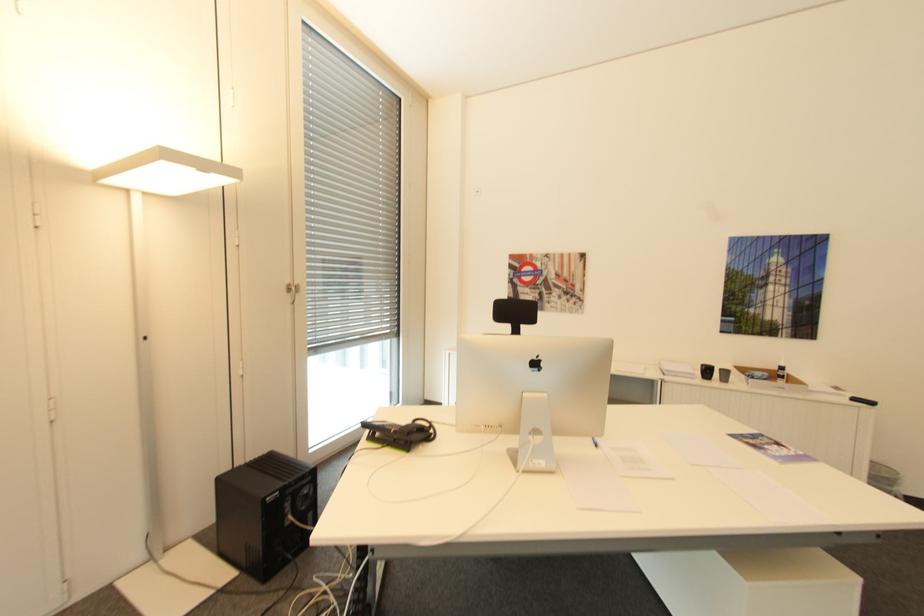
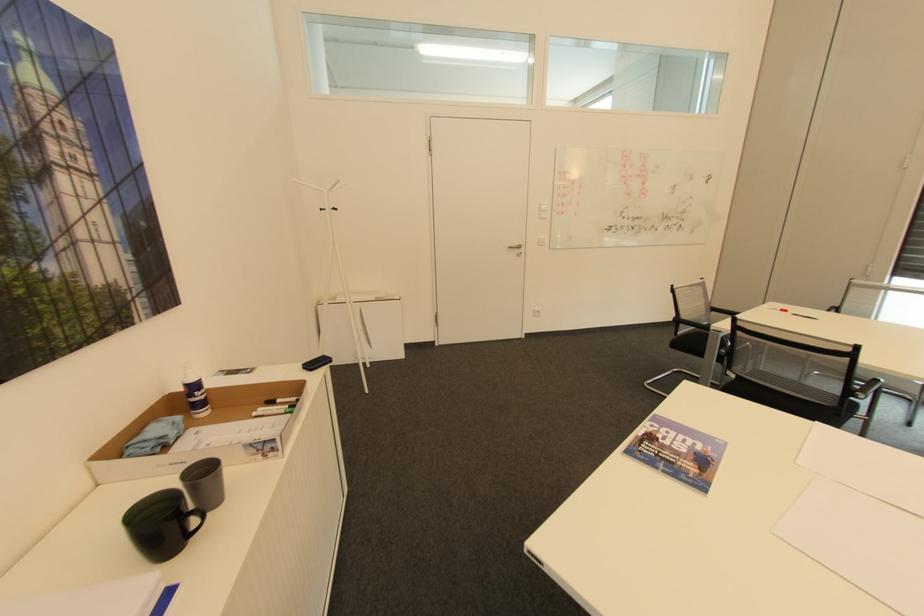
Find the pixel in the second image that matches point 786,363 in the first image.

(197, 379)